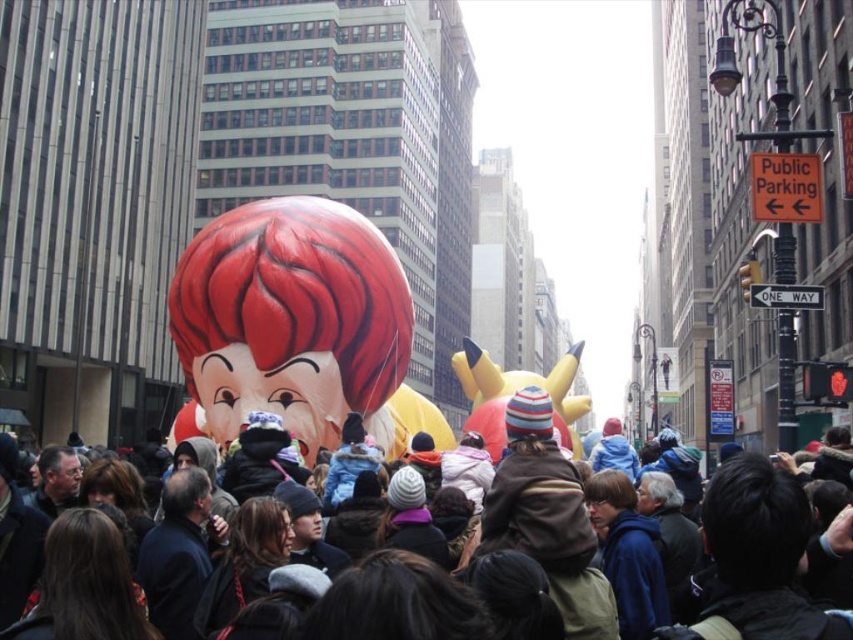
Is point (247, 378) farther from camera compared to point (469, 362)?

No.

Where is `shiny red balloon at center`? shiny red balloon at center is located at coordinates (291, 317).

Between point (767, 492) and point (553, 408), which one is positioned behind?

Point (553, 408)

Which of these two, matte red balloon at center or yellow matte balloon at center, stands taller?

Standing taller between the two is yellow matte balloon at center.

Does point (799, 556) lie in front of point (511, 381)?

Yes, point (799, 556) is closer to viewer.

I want to click on matte red balloon at center, so click(759, 557).

From the picture: Does shiny red balloon at center have a lesser height compared to matte red balloon at center?

In fact, shiny red balloon at center may be taller than matte red balloon at center.

Can you confirm if shiny red balloon at center is positioned to the right of matte red balloon at center?

No, shiny red balloon at center is not to the right of matte red balloon at center.

Who is more forward, (312, 259) or (737, 557)?

Positioned in front is point (737, 557).

Identify the location of shiny red balloon at center. (291, 317).